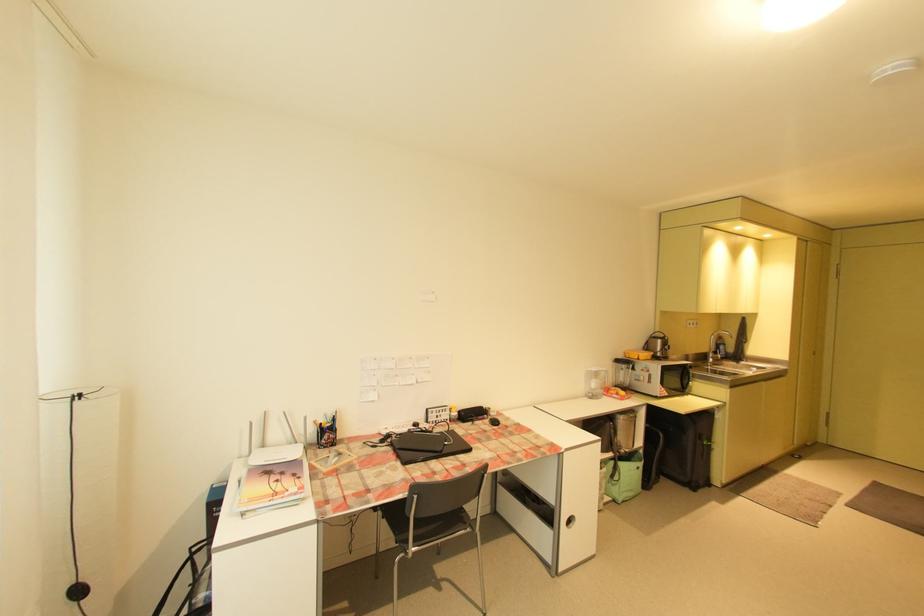
Locate an element on the screen. kettle handle is located at coordinates (647, 345).